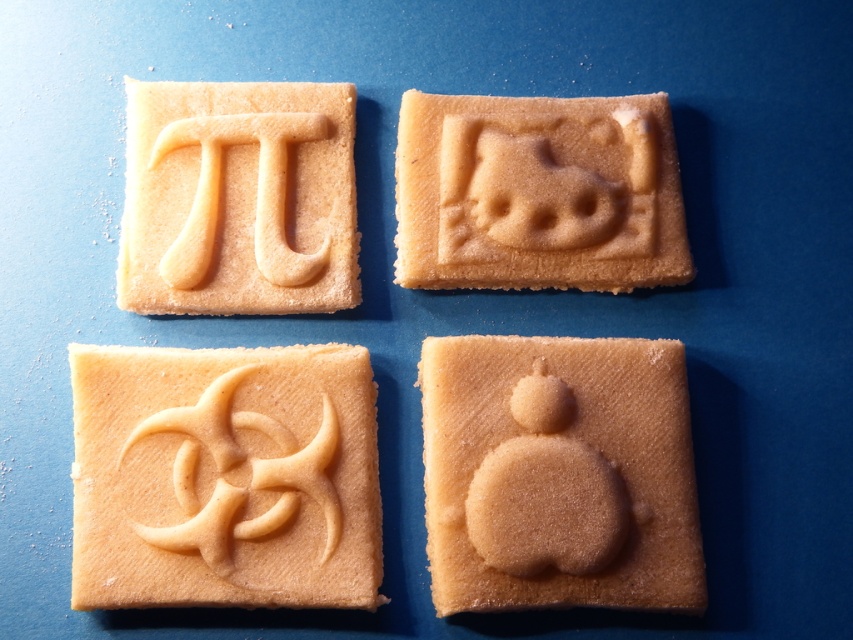
Question: From the image, what is the correct spatial relationship of matte brown cookie at bottom right in relation to matte yellow gingerbread at upper right?

Choices:
 (A) above
 (B) below

Answer: (B)

Question: Which object is positioned farthest from the matte yellow gingerbread at upper right?

Choices:
 (A) matte beige cookie at upper left
 (B) matte brown cookie at bottom right
 (C) matte beige gingerbread at center left

Answer: (C)

Question: Is matte beige gingerbread at center left smaller than matte beige cookie at upper left?

Choices:
 (A) no
 (B) yes

Answer: (A)

Question: Which of these objects is positioned closest to the matte beige cookie at upper left?

Choices:
 (A) matte beige gingerbread at center left
 (B) matte brown cookie at bottom right

Answer: (A)

Question: Is matte beige gingerbread at center left positioned behind matte yellow gingerbread at upper right?

Choices:
 (A) yes
 (B) no

Answer: (B)

Question: Which object is closer to the camera taking this photo?

Choices:
 (A) matte yellow gingerbread at upper right
 (B) matte beige gingerbread at center left
 (C) matte beige cookie at upper left

Answer: (B)